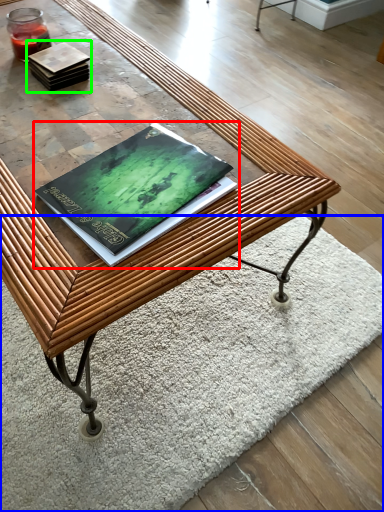
Question: Which object is the closest to the book (highlighted by a red box)? Choose among these: mat (highlighted by a blue box) or book (highlighted by a green box).

Choices:
 (A) mat
 (B) book

Answer: (B)